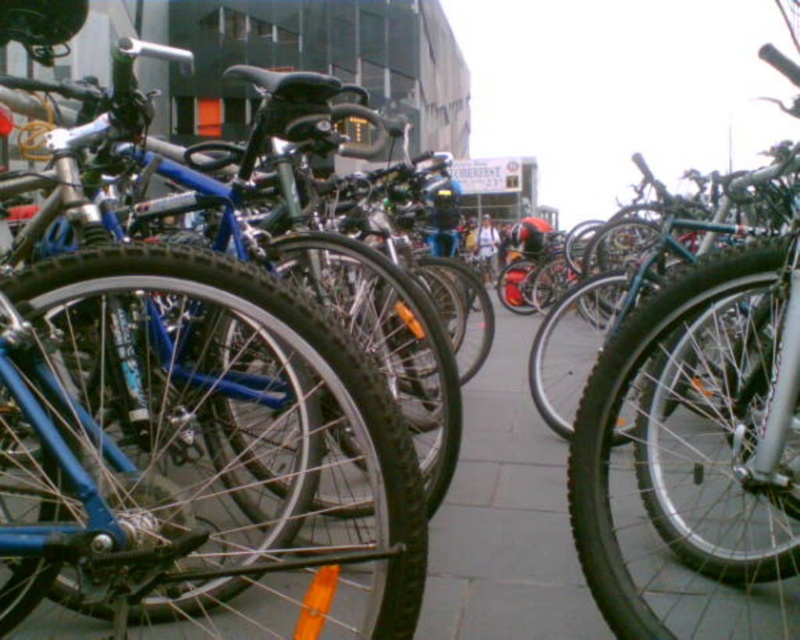
Question: Does blue matte bicycle at left have a larger size compared to gray concrete pavement at center?

Choices:
 (A) yes
 (B) no

Answer: (A)

Question: Can you confirm if blue matte bicycle at left is positioned above gray concrete pavement at center?

Choices:
 (A) yes
 (B) no

Answer: (A)

Question: Among these points, which one is nearest to the camera?

Choices:
 (A) (542, 589)
 (B) (400, 618)

Answer: (B)

Question: Considering the relative positions of blue matte bicycle at left and gray concrete pavement at center in the image provided, where is blue matte bicycle at left located with respect to gray concrete pavement at center?

Choices:
 (A) left
 (B) right

Answer: (A)